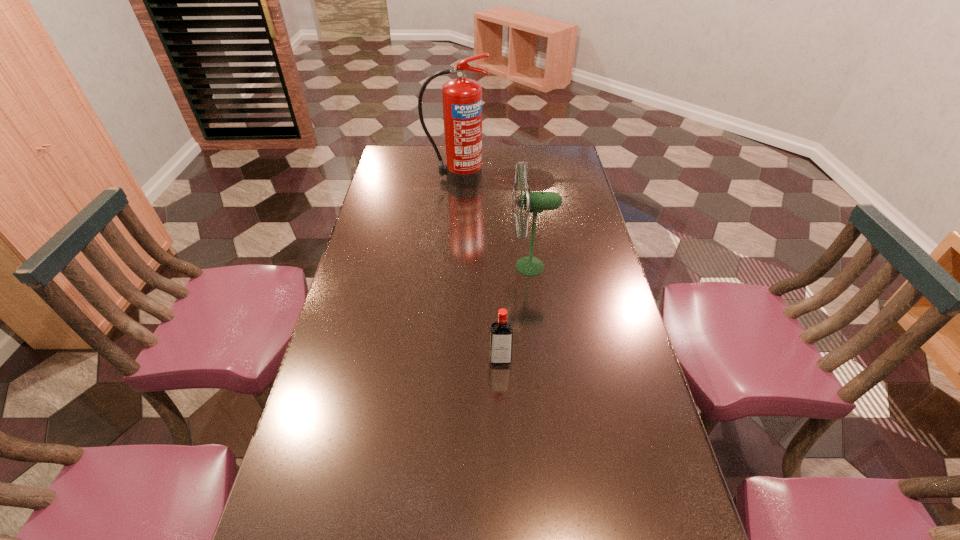
Locate an element on the screen. The height and width of the screenshot is (540, 960). empty space that is in between the fire extinguisher and the second farthest object is located at coordinates (493, 222).

Where is `free space that is in between the second shortest object and the shortest object`? free space that is in between the second shortest object and the shortest object is located at coordinates (516, 313).

What are the coordinates of `object that ranks as the closest to the nearest object` in the screenshot? It's located at (x=533, y=202).

Identify which object is the nearest to the fan. Please provide its 2D coordinates. Your answer should be formatted as a tuple, i.e. [(x, y)], where the tuple contains the x and y coordinates of a point satisfying the conditions above.

[(501, 335)]